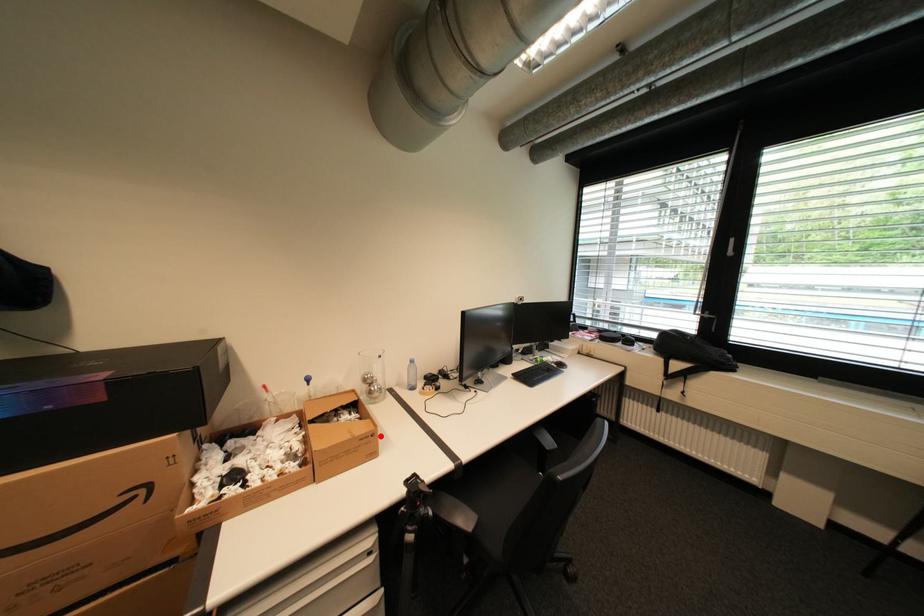
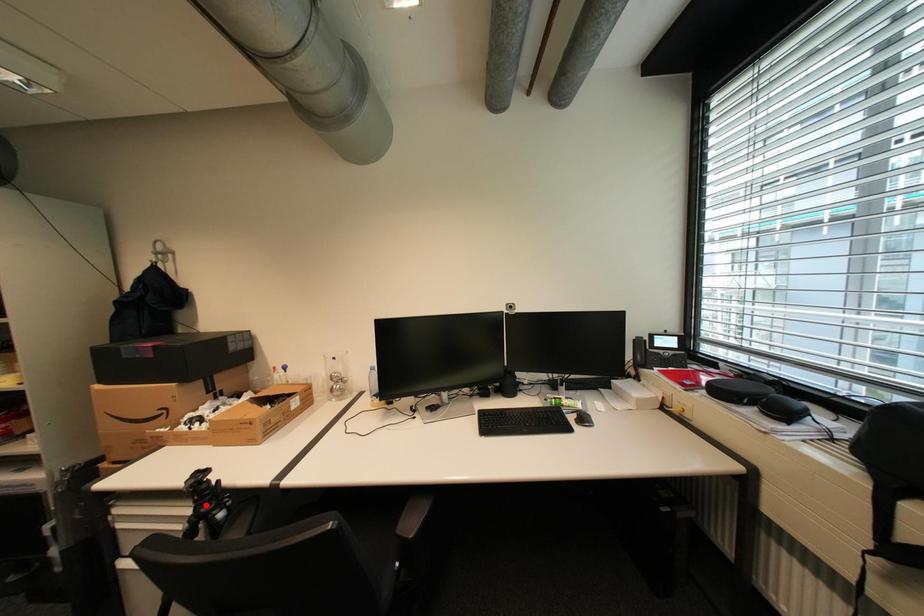
I am providing you with two images of the same scene from different viewpoints. A red point is marked on the first image and another point is marked on the second image. Is the red point in image1 aligned with the point shown in image2?

No